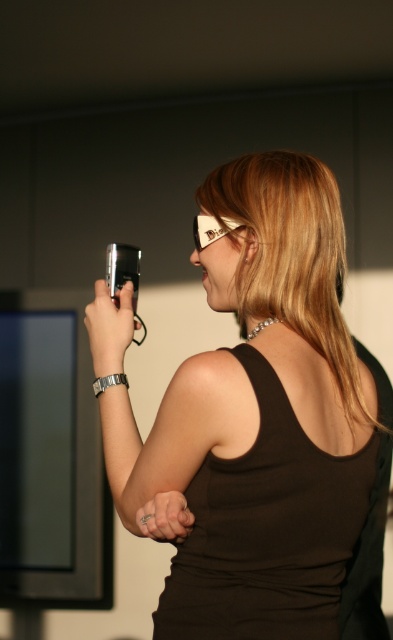
Question: Which object is the closest to the matte black tank top at center?

Choices:
 (A) metallic silver remote at upper left
 (B) black matte tank top at back
 (C) silver metallic ring at center
 (D) white plastic goggles at upper center

Answer: (B)

Question: Which point is farther to the camera?

Choices:
 (A) 389,392
 (B) 117,321
 (C) 361,468
 (D) 229,220

Answer: (A)

Question: Which object is closer to the camera taking this photo?

Choices:
 (A) metallic silver remote at upper left
 (B) white plastic goggles at upper center
 (C) black matte tank top at back
 (D) silver metallic ring at center

Answer: (C)

Question: Is black matte tank top at back thinner than silver metallic ring at center?

Choices:
 (A) yes
 (B) no

Answer: (B)

Question: Can you confirm if matte black tank top at center is positioned to the right of metallic silver remote at upper left?

Choices:
 (A) no
 (B) yes

Answer: (B)

Question: Can you confirm if metallic silver remote at upper left is positioned to the right of white plastic goggles at upper center?

Choices:
 (A) yes
 (B) no

Answer: (B)